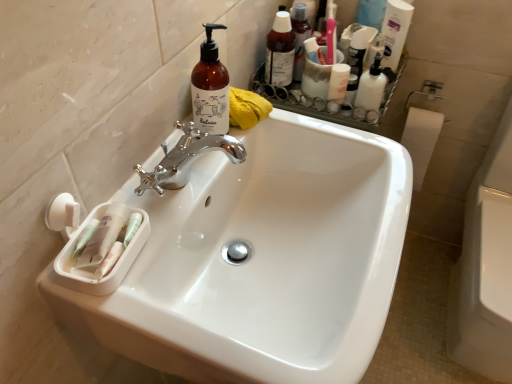
Question: Is translucent plastic pump bottle at upper right, placed as the 1th cleaning product when sorted from top to bottom, smaller than white glossy sink at center?

Choices:
 (A) yes
 (B) no

Answer: (A)

Question: Is translucent plastic pump bottle at upper right, which is counted as the 1th cleaning product, starting from the right, further to the viewer compared to white glossy sink at center?

Choices:
 (A) yes
 (B) no

Answer: (A)

Question: From a real-world perspective, is translucent plastic pump bottle at upper right, which is counted as the 1th cleaning product, starting from the right, physically below white glossy sink at center?

Choices:
 (A) yes
 (B) no

Answer: (B)

Question: Is white glossy sink at center inside translucent plastic pump bottle at upper right, positioned as the 2th cleaning product in left-to-right order?

Choices:
 (A) no
 (B) yes

Answer: (A)

Question: From the image's perspective, is translucent plastic pump bottle at upper right, which appears as the second cleaning product when ordered from the bottom, located beneath white glossy sink at center?

Choices:
 (A) no
 (B) yes

Answer: (A)

Question: Can you confirm if translucent plastic pump bottle at upper right, acting as the 1th cleaning product starting from the back, is taller than white glossy sink at center?

Choices:
 (A) no
 (B) yes

Answer: (A)

Question: Is white glossy toilet at right closer to the viewer compared to white glossy mouthwash at upper right?

Choices:
 (A) yes
 (B) no

Answer: (A)

Question: From the image's perspective, is white glossy toilet at right below white glossy mouthwash at upper right?

Choices:
 (A) no
 (B) yes

Answer: (B)

Question: Is white glossy toilet at right far from white glossy mouthwash at upper right?

Choices:
 (A) no
 (B) yes

Answer: (A)

Question: Considering the relative sizes of white glossy toilet at right and white glossy mouthwash at upper right in the image provided, is white glossy toilet at right smaller than white glossy mouthwash at upper right?

Choices:
 (A) no
 (B) yes

Answer: (A)

Question: Is white glossy toilet at right shorter than white glossy mouthwash at upper right?

Choices:
 (A) yes
 (B) no

Answer: (B)

Question: Is white glossy toilet at right positioned with its back to white glossy mouthwash at upper right?

Choices:
 (A) no
 (B) yes

Answer: (A)

Question: Can you confirm if white glossy sink at center is thinner than brown glass bottle at upper center, which appears as the second cleaning product when viewed from the top?

Choices:
 (A) no
 (B) yes

Answer: (A)